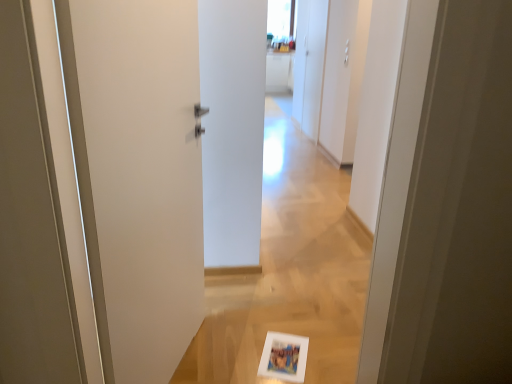
Question: Considering the positions of point (316, 11) and point (103, 352), is point (316, 11) closer or farther from the camera than point (103, 352)?

Choices:
 (A) closer
 (B) farther

Answer: (B)

Question: From a real-world perspective, is white matte cabinet at upper right physically located above or below white matte door at left?

Choices:
 (A) below
 (B) above

Answer: (B)

Question: Looking at their shapes, would you say white matte cabinet at upper right is wider or thinner than white matte door at left?

Choices:
 (A) thin
 (B) wide

Answer: (A)

Question: From the image's perspective, relative to white matte cabinet at upper right, is white matte door at left above or below?

Choices:
 (A) above
 (B) below

Answer: (B)

Question: Considering the positions of point (157, 180) and point (312, 74), is point (157, 180) closer or farther from the camera than point (312, 74)?

Choices:
 (A) farther
 (B) closer

Answer: (B)

Question: From their relative heights in the image, would you say white matte door at left is taller or shorter than white matte cabinet at upper right?

Choices:
 (A) tall
 (B) short

Answer: (B)

Question: Considering the relative positions of white matte door at left and white matte cabinet at upper right in the image provided, is white matte door at left to the left or to the right of white matte cabinet at upper right?

Choices:
 (A) right
 (B) left

Answer: (B)